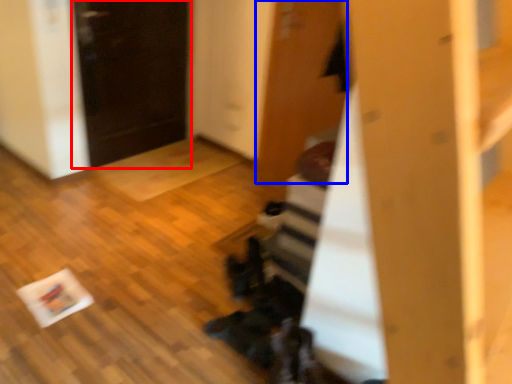
Question: Which object is further to the camera taking this photo, door (highlighted by a red box) or door (highlighted by a blue box)?

Choices:
 (A) door
 (B) door

Answer: (A)